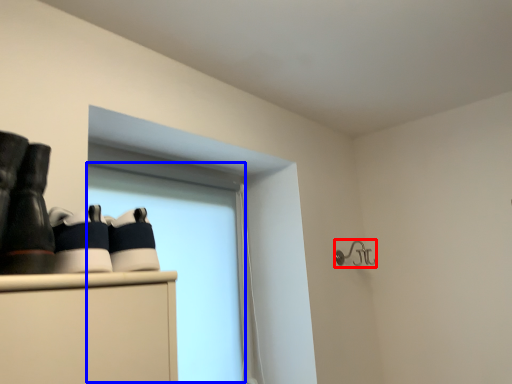
Question: Which of the following is the farthest to the observer, shower (highlighted by a red box) or window screen (highlighted by a blue box)?

Choices:
 (A) shower
 (B) window screen

Answer: (A)